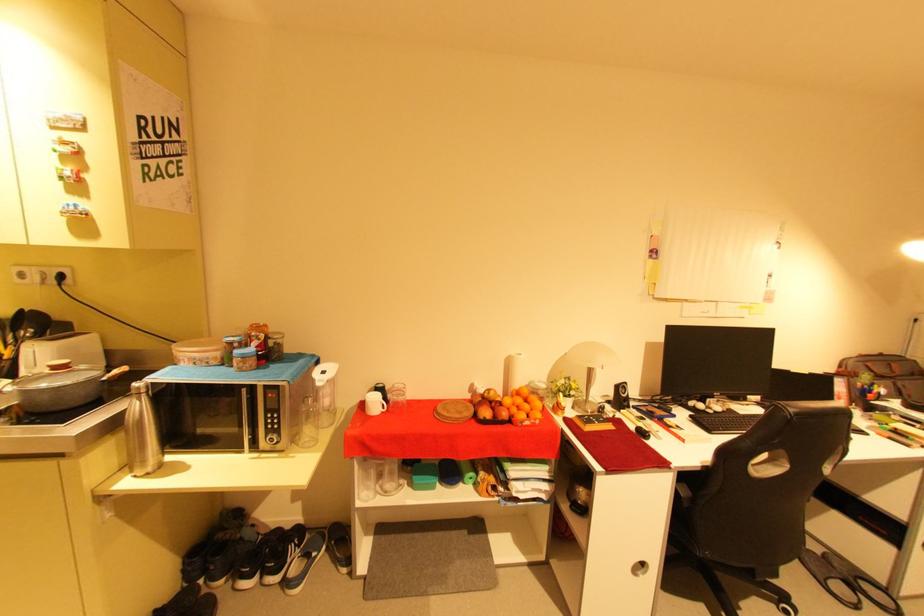
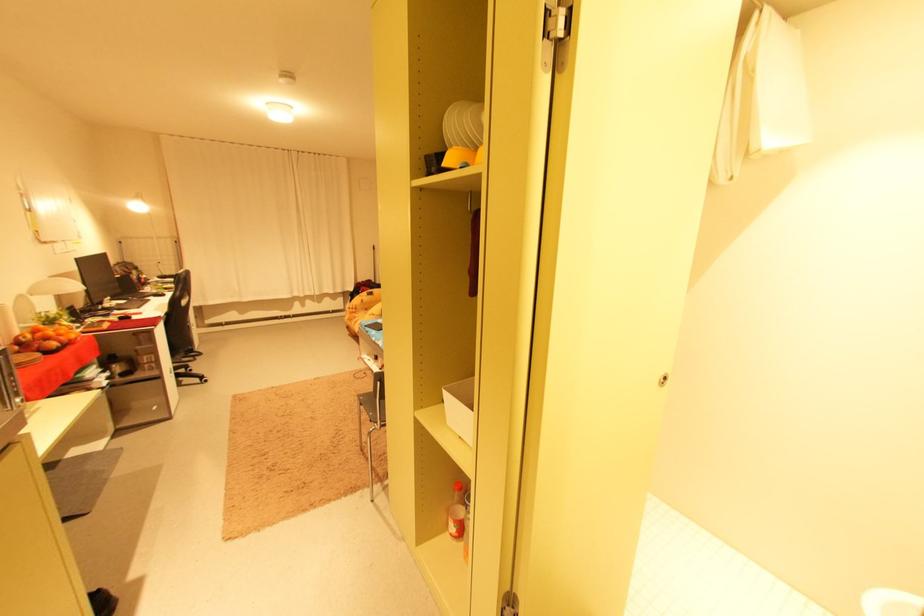
Find the pixel in the second image that matches the point at 503,416 in the first image.

(68, 344)